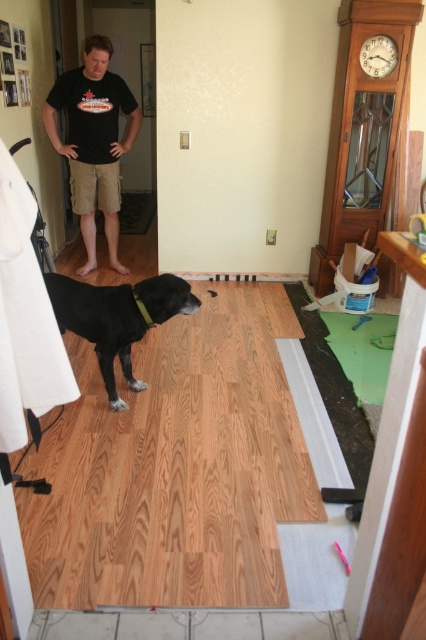
Looking at this image, can you confirm if brown wood flooring at center is shorter than matte black t-shirt at center?

Yes.

Can you confirm if brown wood flooring at center is bigger than matte black t-shirt at center?

Correct, brown wood flooring at center is larger in size than matte black t-shirt at center.

You are a GUI agent. You are given a task and a screenshot of the screen. Output one action in this format:
    pyautogui.click(x=<x>, y=<y>)
    Task: Click on the brown wood flooring at center
    
    Given the screenshot: What is the action you would take?
    pyautogui.click(x=175, y=467)

Image resolution: width=426 pixels, height=640 pixels. Identify the location of brown wood flooring at center. (175, 467).

Which is behind, point (43, 104) or point (69, 298)?

The point (43, 104) is behind.

What do you see at coordinates (94, 141) in the screenshot? The width and height of the screenshot is (426, 640). I see `matte black t-shirt at center` at bounding box center [94, 141].

I want to click on matte black t-shirt at center, so click(x=94, y=141).

Find the location of `matte black t-shirt at center`. matte black t-shirt at center is located at coordinates (94, 141).

Is brown wood flooring at center above black matte dog at center?

Actually, brown wood flooring at center is below black matte dog at center.

Between brown wood flooring at center and black matte dog at center, which one is positioned lower?

brown wood flooring at center is below.

Identify the location of brown wood flooring at center. (175, 467).